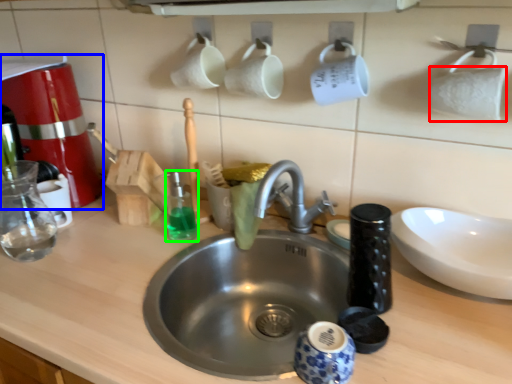
Question: Estimate the real-world distances between objects in this image. Which object is closer to toilet paper (highlighted by a red box), coffee machine (highlighted by a blue box) or cleaning product (highlighted by a green box)?

Choices:
 (A) coffee machine
 (B) cleaning product

Answer: (B)